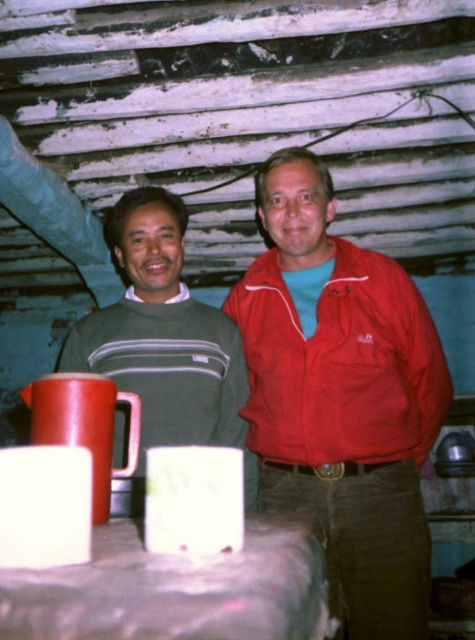
Does matte red jacket at center have a greater height compared to matte red mug at center?

Correct, matte red jacket at center is much taller as matte red mug at center.

Which is behind, point (417, 424) or point (150, 497)?

Positioned behind is point (417, 424).

The width and height of the screenshot is (475, 640). Identify the location of matte red jacket at center. (342, 397).

Looking at this image, who is lower down, matte red jacket at center or matte red mug at lower left?

matte red mug at lower left is lower down.

Is point (389, 292) positioned in front of point (75, 410)?

No, it is not.

Find the location of a particular element. The image size is (475, 640). matte red jacket at center is located at coordinates 342,397.

Is red matte jacket at center shorter than matte red mug at lower left?

No, red matte jacket at center is not shorter than matte red mug at lower left.

Does point (408, 433) come in front of point (102, 497)?

No, it is behind (102, 497).

What do you see at coordinates (341, 364) in the screenshot? The image size is (475, 640). I see `red matte jacket at center` at bounding box center [341, 364].

You are a GUI agent. You are given a task and a screenshot of the screen. Output one action in this format:
    pyautogui.click(x=<x>, y=<y>)
    Task: Click on the red matte jacket at center
    This screenshot has height=640, width=475.
    Given the screenshot: What is the action you would take?
    (341, 364)